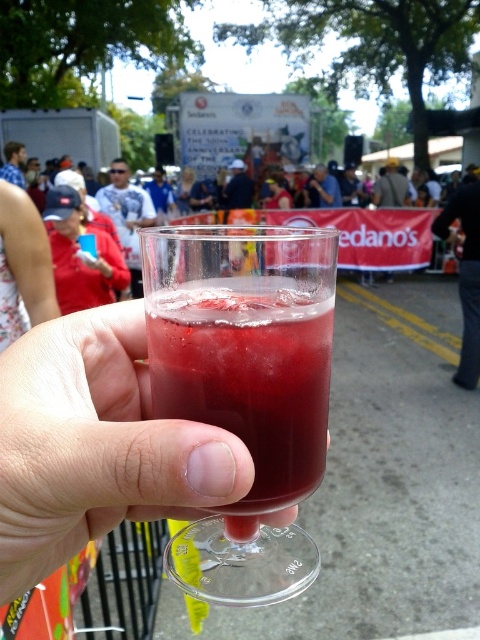
Based on the photo, does transparent glass at center appear on the right side of clear plastic cup at center?

Correct, you'll find transparent glass at center to the right of clear plastic cup at center.

Locate an element on the screen. transparent glass at center is located at coordinates (244, 387).